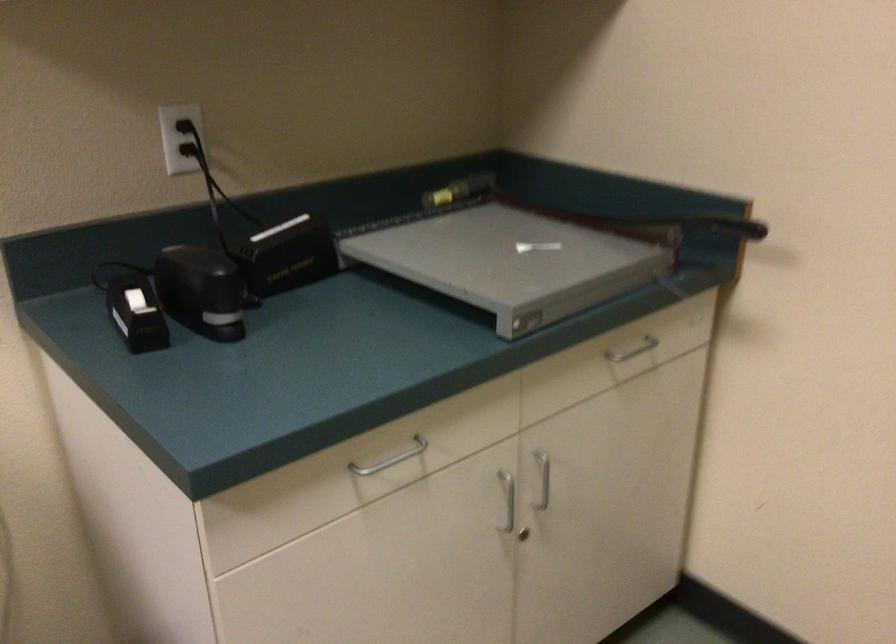
You are a GUI agent. You are given a task and a screenshot of the screen. Output one action in this format:
    pyautogui.click(x=<x>, y=<y>)
    Task: Click on the paper cutter handle
    
    Given the screenshot: What is the action you would take?
    pyautogui.click(x=742, y=228)